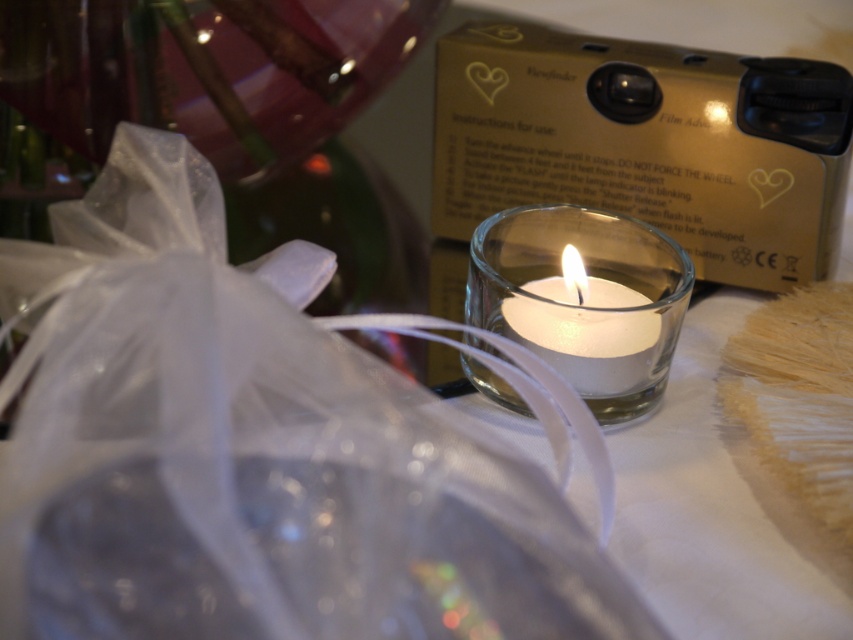
You are a delivery person who needs to place a small package between the white satin ribbon at center and the white matte candle at center. The package measures 12 centimeters in length. Will it fit in the space between them?

The distance between the white satin ribbon at center and the white matte candle at center is 11.77 centimeters. Since the package is 12 centimeters long, it will not fit in the space between them as the package is slightly longer than the available gap.

What object is located at the coordinates point (x=250, y=451)?

The point (x=250, y=451) corresponds to the white satin ribbon at center.

You are arranging items on a table and need to ensure proper placement. Given the white satin ribbon at center and the transparent glass candle at center, which object is positioned lower in the scene?

The white satin ribbon at center is positioned below the transparent glass candle at center, so it is lower in the scene.